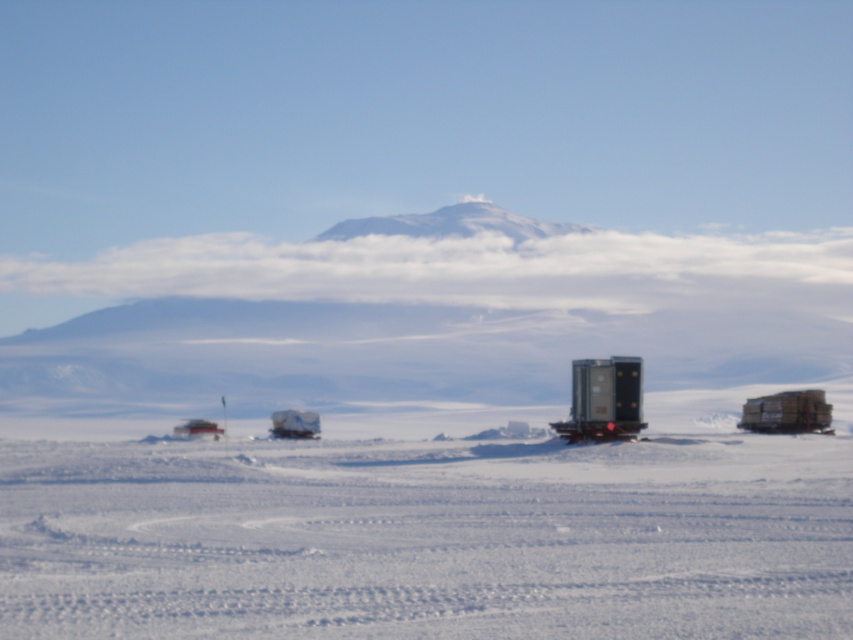
Question: Which object is closer to the camera taking this photo?

Choices:
 (A) white matte snow at center
 (B) white snow-covered mountain at center
 (C) matte black vehicle at lower left

Answer: (A)

Question: Does white matte snow at center have a lesser width compared to matte black vehicle at lower left?

Choices:
 (A) yes
 (B) no

Answer: (B)

Question: Among these objects, which one is nearest to the camera?

Choices:
 (A) white matte snow at center
 (B) wooden crates at right
 (C) white plastic boat at center

Answer: (A)

Question: Considering the relative positions of metallic trailer truck at center and white snow-covered mountain at center in the image provided, where is metallic trailer truck at center located with respect to white snow-covered mountain at center?

Choices:
 (A) right
 (B) left

Answer: (A)

Question: Considering the relative positions of metallic trailer truck at center and matte black vehicle at lower left in the image provided, where is metallic trailer truck at center located with respect to matte black vehicle at lower left?

Choices:
 (A) below
 (B) above

Answer: (B)

Question: Among these objects, which one is farthest from the camera?

Choices:
 (A) wooden crates at right
 (B) white snow-covered mountain at center
 (C) white plastic boat at center
 (D) matte black vehicle at lower left

Answer: (B)